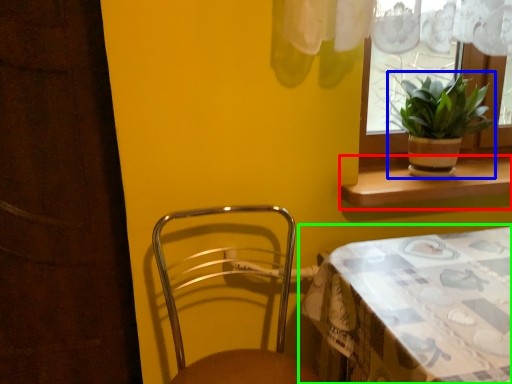
Question: Which object is positioned farthest from window sill (highlighted by a red box)? Select from houseplant (highlighted by a blue box) and table (highlighted by a green box).

Choices:
 (A) houseplant
 (B) table

Answer: (B)